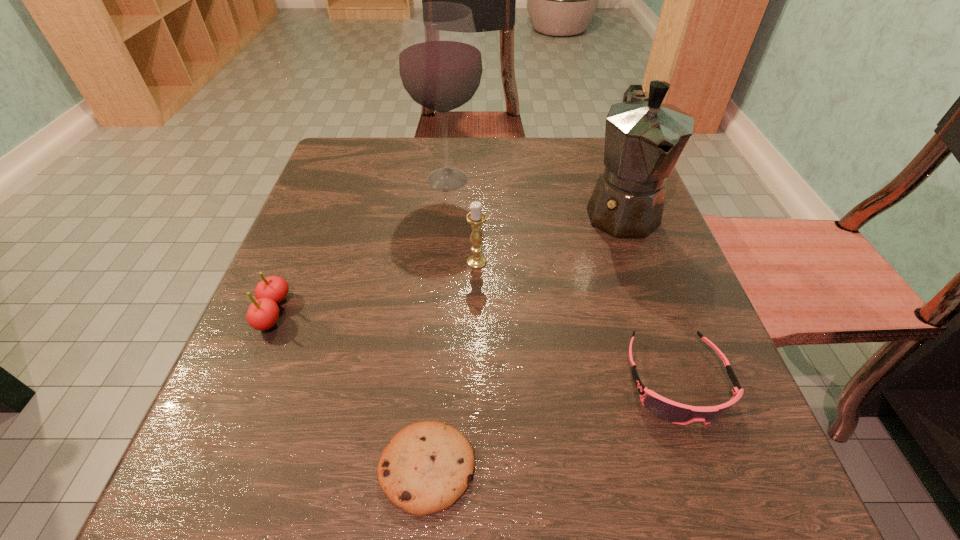
The image size is (960, 540). In order to click on free space between the fifth tallest object and the alcohol in this screenshot , I will do `click(562, 280)`.

The height and width of the screenshot is (540, 960). In order to click on unoccupied area between the coffeepot and the leftmost object in this screenshot , I will do `click(446, 262)`.

I want to click on free space between the tallest object and the shortest object, so click(x=438, y=324).

This screenshot has height=540, width=960. I want to click on empty space that is in between the goggles and the fifth shortest object, so click(649, 296).

I want to click on free space that is in between the leftmost object and the goggles, so click(x=474, y=347).

Where is `free spot between the tallest object and the cherry`? The image size is (960, 540). free spot between the tallest object and the cherry is located at coordinates (360, 246).

You are a GUI agent. You are given a task and a screenshot of the screen. Output one action in this format:
    pyautogui.click(x=<x>, y=<y>)
    Task: Click on the vacant area that lies between the tallest object and the fourth tallest object
    
    Given the screenshot: What is the action you would take?
    pyautogui.click(x=360, y=246)

Identify the location of free space between the cherry and the candle holder. (374, 287).

Identify which object is the third closest to the fourth tallest object. Please provide its 2D coordinates. Your answer should be formatted as a tuple, i.e. [(x, y)], where the tuple contains the x and y coordinates of a point satisfying the conditions above.

[(440, 63)]

Find the location of `object that is the closest to the shortest object`. object that is the closest to the shortest object is located at coordinates (671, 411).